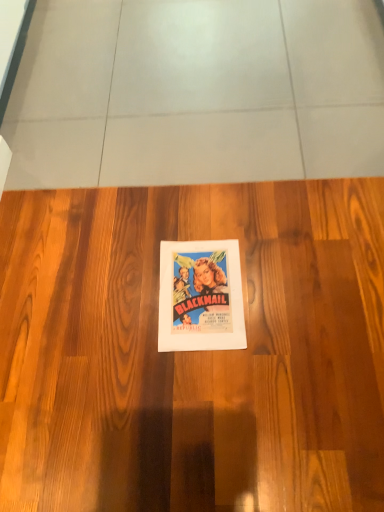
The width and height of the screenshot is (384, 512). Find the location of `vacant area located to the right-hand side of vibrant paper poster at center`. vacant area located to the right-hand side of vibrant paper poster at center is located at coordinates (289, 279).